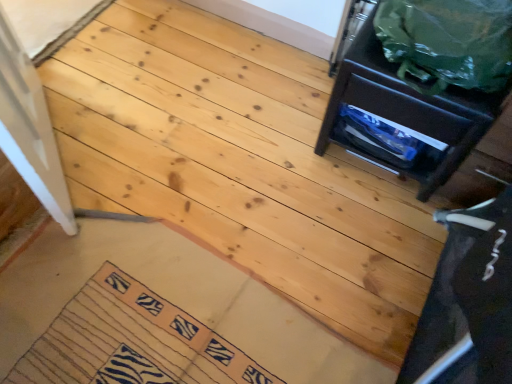
Question: Visually, is green plastic bag at upper right positioned to the left or to the right of matte black drawer at upper right?

Choices:
 (A) left
 (B) right

Answer: (B)

Question: Is green plastic bag at upper right bigger or smaller than matte black drawer at upper right?

Choices:
 (A) big
 (B) small

Answer: (B)

Question: Which object is the farthest from the green plastic bag at upper right?

Choices:
 (A) matte black drawer at upper right
 (B) zebra-patterned fabric mat at lower left

Answer: (B)

Question: Which object is the closest to the matte black drawer at upper right?

Choices:
 (A) zebra-patterned fabric mat at lower left
 (B) green plastic bag at upper right

Answer: (B)